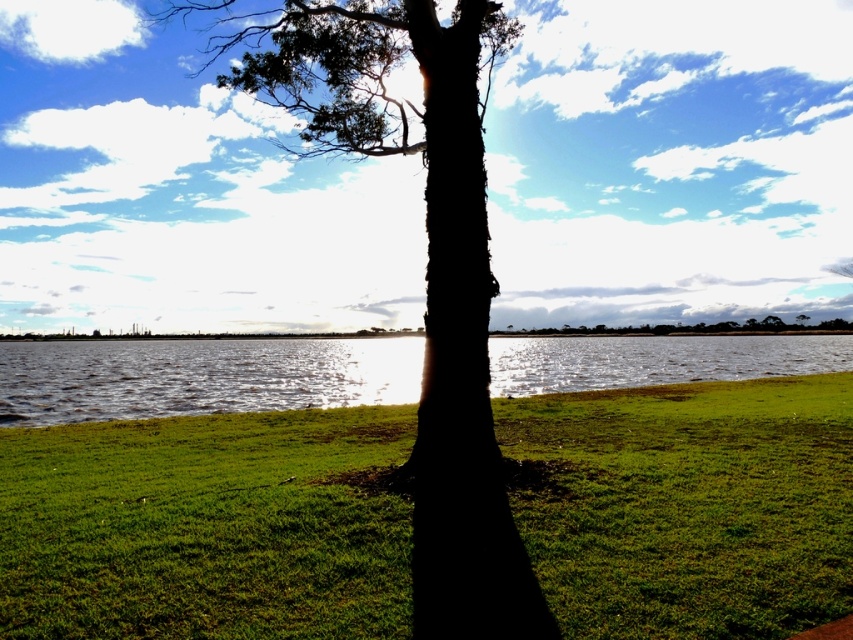
Question: Is green grassy at center to the right of glistening water at center from the viewer's perspective?

Choices:
 (A) no
 (B) yes

Answer: (B)

Question: Among these points, which one is nearest to the camera?

Choices:
 (A) (379, 147)
 (B) (155, 608)
 (C) (840, 356)

Answer: (B)

Question: Is green grassy at center bigger than dark bark tree at center?

Choices:
 (A) yes
 (B) no

Answer: (B)

Question: Which object appears farthest from the camera in this image?

Choices:
 (A) green grassy at center
 (B) dark bark tree at center

Answer: (B)

Question: Which of the following is the farthest from the observer?

Choices:
 (A) dark bark tree at center
 (B) glistening water at center
 (C) green grassy at center

Answer: (B)

Question: Is green grassy at center bigger than dark bark tree at center?

Choices:
 (A) yes
 (B) no

Answer: (B)